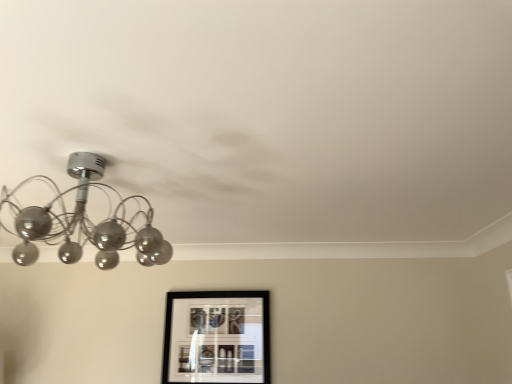
Question: Is metallic glass chandelier at upper left taller or shorter than black matte picture frame at lower center?

Choices:
 (A) tall
 (B) short

Answer: (B)

Question: Is metallic glass chandelier at upper left in front of or behind black matte picture frame at lower center in the image?

Choices:
 (A) front
 (B) behind

Answer: (A)

Question: Would you say metallic glass chandelier at upper left is inside or outside black matte picture frame at lower center?

Choices:
 (A) outside
 (B) inside

Answer: (A)

Question: Visually, is black matte picture frame at lower center positioned to the left or to the right of metallic glass chandelier at upper left?

Choices:
 (A) right
 (B) left

Answer: (A)

Question: Is point (198, 324) positioned closer to the camera than point (88, 162)?

Choices:
 (A) farther
 (B) closer

Answer: (A)

Question: Based on their sizes in the image, would you say black matte picture frame at lower center is bigger or smaller than metallic glass chandelier at upper left?

Choices:
 (A) small
 (B) big

Answer: (A)

Question: Is black matte picture frame at lower center taller or shorter than metallic glass chandelier at upper left?

Choices:
 (A) short
 (B) tall

Answer: (B)